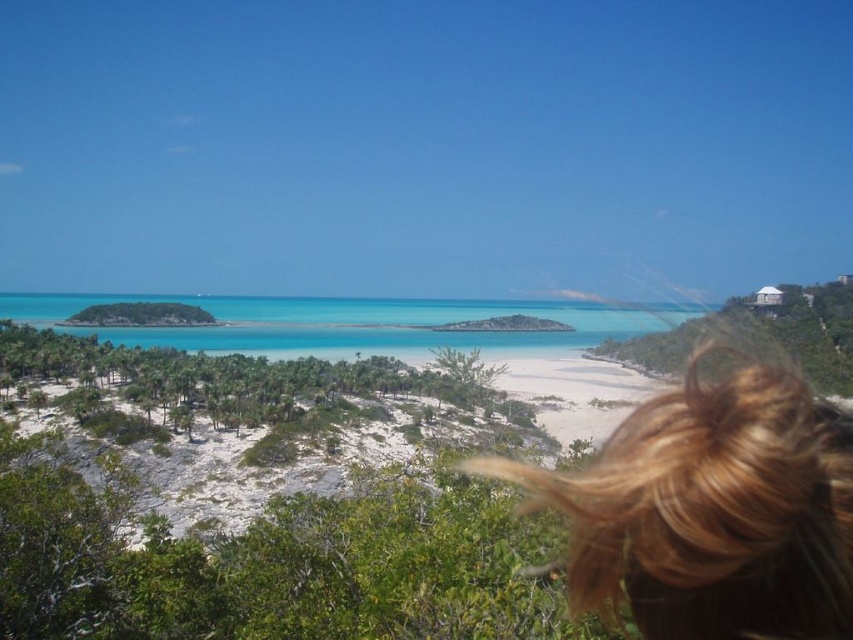
You are a photographer taking a picture of the tropical landscape. You want to ensure the blonde hair at lower right and the turquoise crystal clear water at center are both visible. Which object will appear smaller in the photo?

The blonde hair at lower right appears smaller in the photo because it is not as tall as the turquoise crystal clear water at center, so it would occupy less space in the frame.

You are a photographer trying to capture the scene. You notice the blonde hair at lower right and the turquoise crystal clear water at center. Which object appears narrower in the image?

The blonde hair at lower right appears narrower than the turquoise crystal clear water at center.